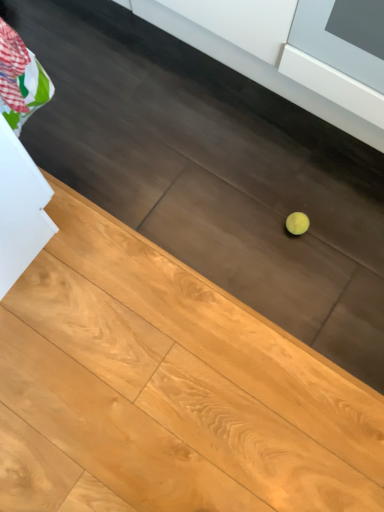
Locate an element on the screen. This screenshot has width=384, height=512. light wood plank at lower center is located at coordinates (222, 331).

The height and width of the screenshot is (512, 384). What do you see at coordinates (222, 331) in the screenshot? I see `light wood plank at lower center` at bounding box center [222, 331].

Find the location of a particular element. The image size is (384, 512). light wood plank at lower center is located at coordinates click(222, 331).